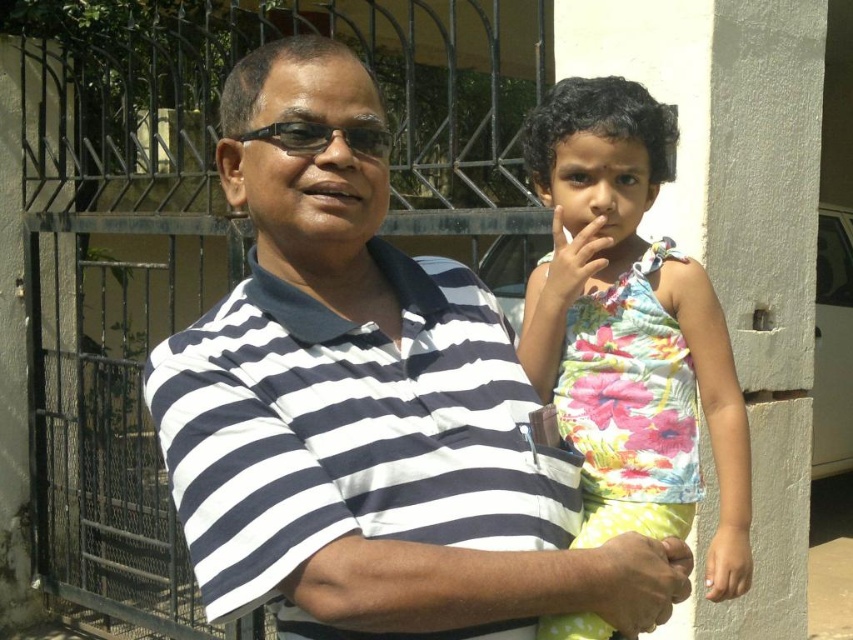
Does white striped shirt at center have a greater height compared to floral fabric dress at center?

No, white striped shirt at center is not taller than floral fabric dress at center.

Between point (177, 481) and point (643, 122), which one is positioned in front?

Point (177, 481) is in front.

Does point (457, 401) come closer to viewer compared to point (585, 536)?

Yes, it is in front of point (585, 536).

Identify the location of white striped shirt at center. This screenshot has width=853, height=640. (368, 412).

Can you confirm if white striped shirt at center is positioned above black plastic glasses at center?

No.

This screenshot has width=853, height=640. Describe the element at coordinates (368, 412) in the screenshot. I see `white striped shirt at center` at that location.

You are a GUI agent. You are given a task and a screenshot of the screen. Output one action in this format:
    pyautogui.click(x=<x>, y=<y>)
    Task: Click on the white striped shirt at center
    This screenshot has width=853, height=640.
    Given the screenshot: What is the action you would take?
    pyautogui.click(x=368, y=412)

The width and height of the screenshot is (853, 640). What are the coordinates of `white striped shirt at center` in the screenshot? It's located at (368, 412).

Find the location of `floral fabric dress at center`. floral fabric dress at center is located at coordinates (630, 330).

Is point (618, 240) more distant than point (296, 134)?

Yes, it is.

What do you see at coordinates (630, 330) in the screenshot?
I see `floral fabric dress at center` at bounding box center [630, 330].

Find the location of a particular element. This screenshot has height=640, width=853. floral fabric dress at center is located at coordinates (630, 330).